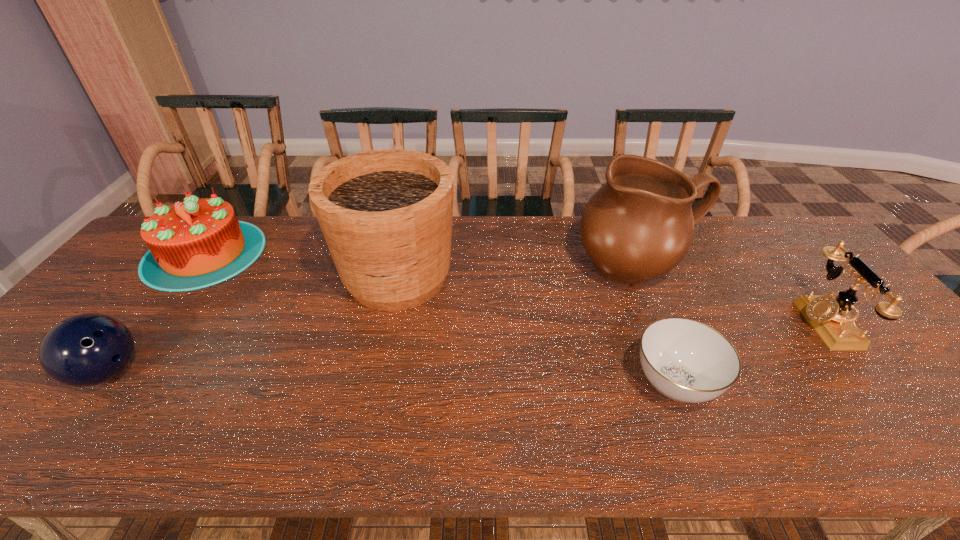
I want to click on cream pitcher, so click(639, 225).

Find the location of a particular element. This screenshot has width=960, height=540. flowerpot is located at coordinates (386, 215).

Locate an element on the screen. This screenshot has width=960, height=540. cake is located at coordinates (197, 243).

This screenshot has width=960, height=540. Find the location of `telephone`. telephone is located at coordinates (831, 318).

Locate an element on the screen. The image size is (960, 540). the second shortest object is located at coordinates coord(85,350).

Image resolution: width=960 pixels, height=540 pixels. In order to click on the shortest object in this screenshot , I will do `click(687, 361)`.

Find the location of `free location located at the spout of the cream pitcher`. free location located at the spout of the cream pitcher is located at coordinates (690, 388).

Locate an element on the screen. This screenshot has height=540, width=960. vacant space situated 0.050m on the front of the third object from left to right is located at coordinates (385, 335).

This screenshot has height=540, width=960. I want to click on free location located on the front of the cake, so click(x=99, y=392).

You are a GUI agent. You are given a task and a screenshot of the screen. Output one action in this format:
    pyautogui.click(x=<x>, y=<y>)
    Task: Click on the free space located 0.170m on the dial of the rightmost object
    This screenshot has height=540, width=960.
    Given the screenshot: What is the action you would take?
    pyautogui.click(x=737, y=323)